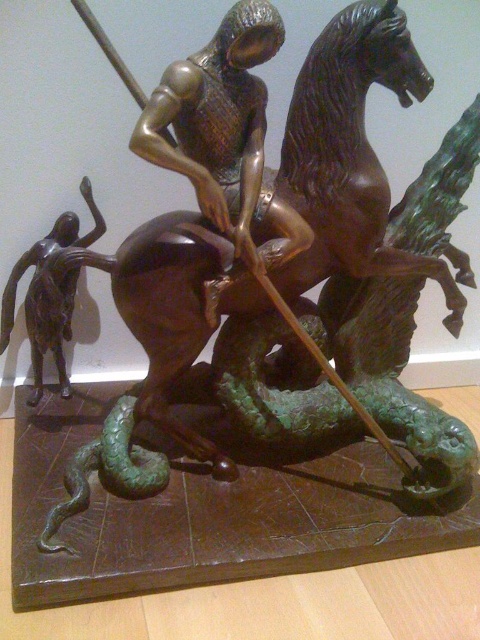
In the scene shown: Can you confirm if bronze figure at center is positioned to the right of bronze figure at left?

Indeed, bronze figure at center is positioned on the right side of bronze figure at left.

Who is lower down, bronze figure at center or bronze figure at left?

bronze figure at left is below.

Identify the location of bronze figure at center. (225, 132).